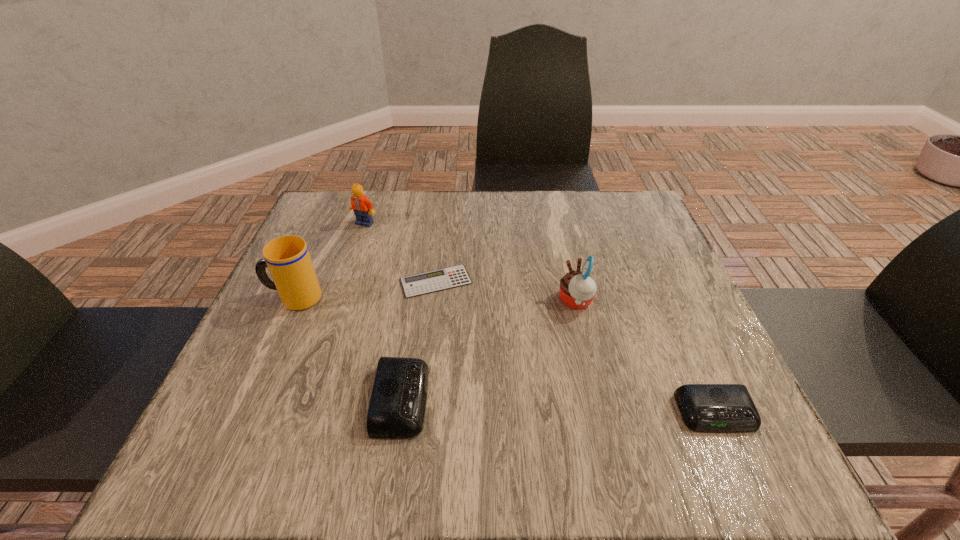
Find the location of a particular element. This screenshot has width=960, height=540. vacant space situated 0.060m on the display of the taller alarm clock is located at coordinates (462, 400).

Locate an element on the screen. The image size is (960, 540). vacant position located 0.070m on the front-facing side of the farthest object is located at coordinates [358, 244].

Locate an element on the screen. The height and width of the screenshot is (540, 960). free space located on the front-facing side of the muffin is located at coordinates (397, 301).

This screenshot has height=540, width=960. What are the coordinates of `vacant area situated on the front-facing side of the muffin` in the screenshot? It's located at (468, 301).

Find the location of a particular element. blank area located 0.260m on the front-facing side of the muffin is located at coordinates (435, 301).

This screenshot has height=540, width=960. Find the location of `free space located on the right of the shortest object`. free space located on the right of the shortest object is located at coordinates (643, 281).

This screenshot has height=540, width=960. I want to click on object that is at the far edge, so click(x=362, y=207).

Identify the location of Lego that is at the left edge. (362, 207).

The height and width of the screenshot is (540, 960). I want to click on cup located in the left edge section of the desktop, so click(288, 259).

Where is `object that is positioned at the right edge`? The height and width of the screenshot is (540, 960). object that is positioned at the right edge is located at coordinates (725, 408).